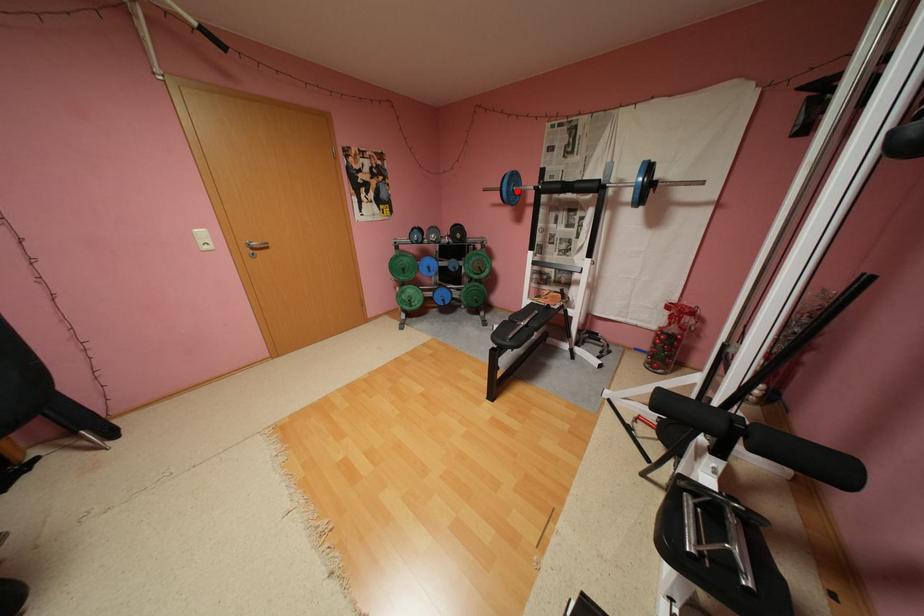
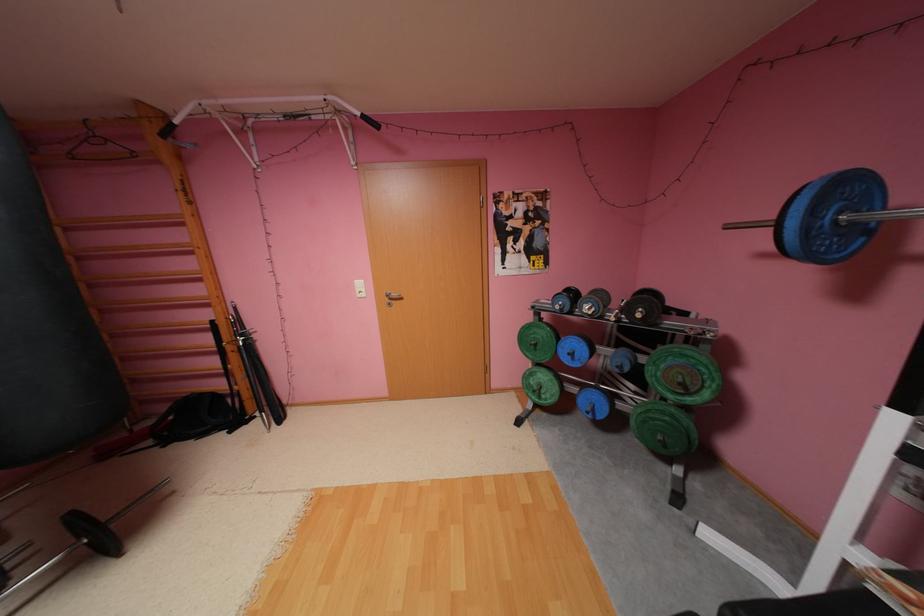
Question: A red point is marked in image1. In image2, is the corresponding 3D point closer to the camera or farther? Reply with the corresponding letter.

Choices:
 (A) The corresponding 3D point is closer.
 (B) The corresponding 3D point is farther.

Answer: (B)